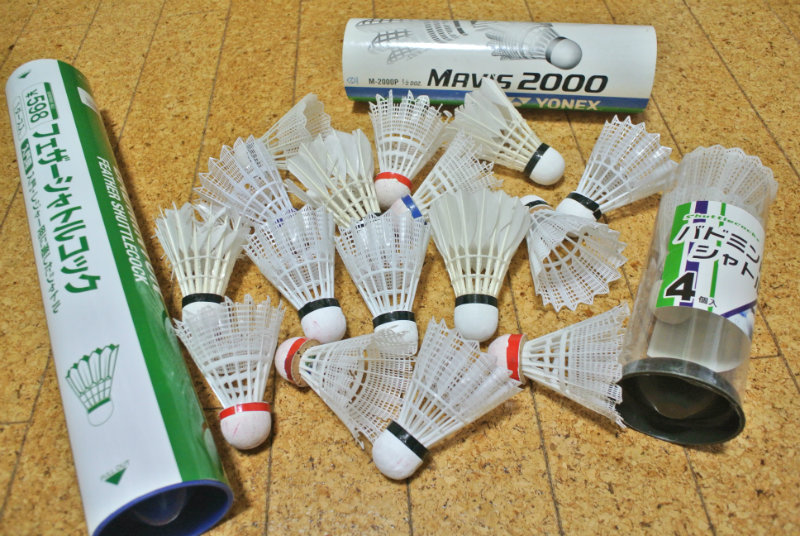
Find the location of `pot`. pot is located at coordinates (468, 232).